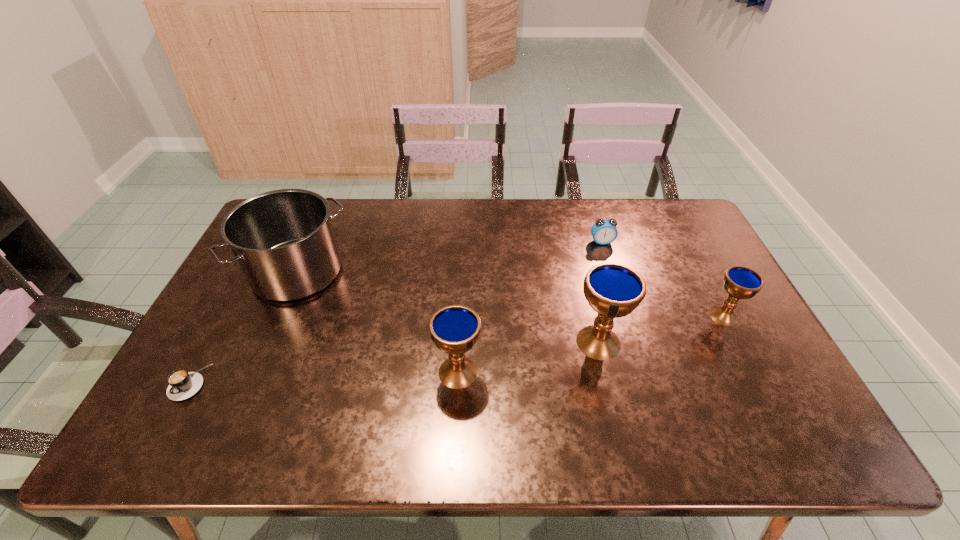
Where is `vacant region located on the left of the third shortest object`? The width and height of the screenshot is (960, 540). vacant region located on the left of the third shortest object is located at coordinates (675, 315).

Locate an element on the screen. This screenshot has height=540, width=960. free space located 0.230m on the right of the saucepan is located at coordinates (421, 272).

Identify the location of free space located 0.200m on the face of the alarm clock. (616, 288).

I want to click on object located at the far edge, so click(x=604, y=231).

Find the location of a particular element. This screenshot has width=960, height=540. chalice located in the near edge section of the desktop is located at coordinates (454, 329).

Locate an element on the screen. The width and height of the screenshot is (960, 540). cappuccino that is at the near edge is located at coordinates (182, 384).

What are the coordinates of `saucepan that is at the left edge` in the screenshot? It's located at (283, 240).

Identify the location of cappuccino that is at the left edge. This screenshot has height=540, width=960. click(x=182, y=384).

Where is `object located in the right edge section of the desktop`? The image size is (960, 540). object located in the right edge section of the desktop is located at coordinates (740, 282).

Find the location of `object that is at the near left corner`. object that is at the near left corner is located at coordinates (182, 384).